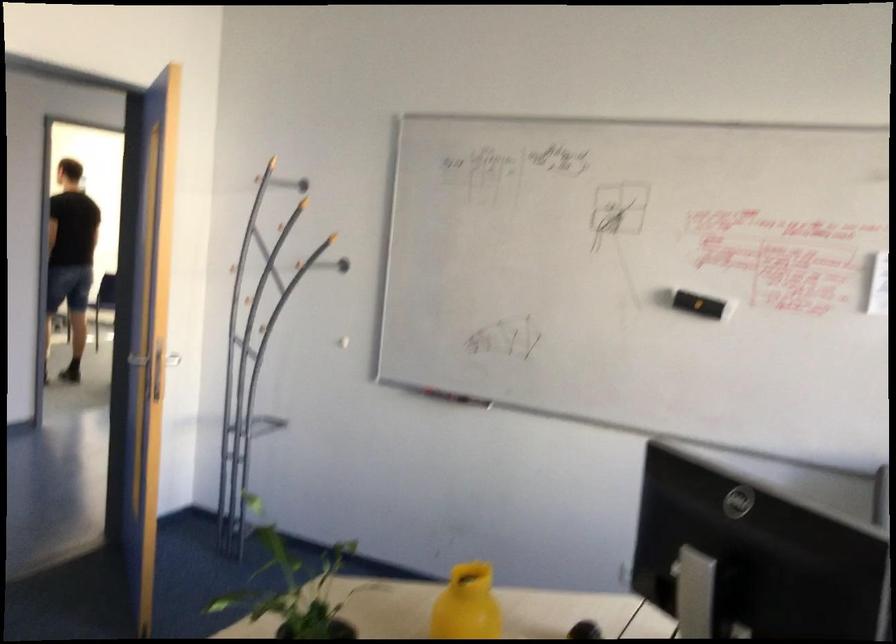
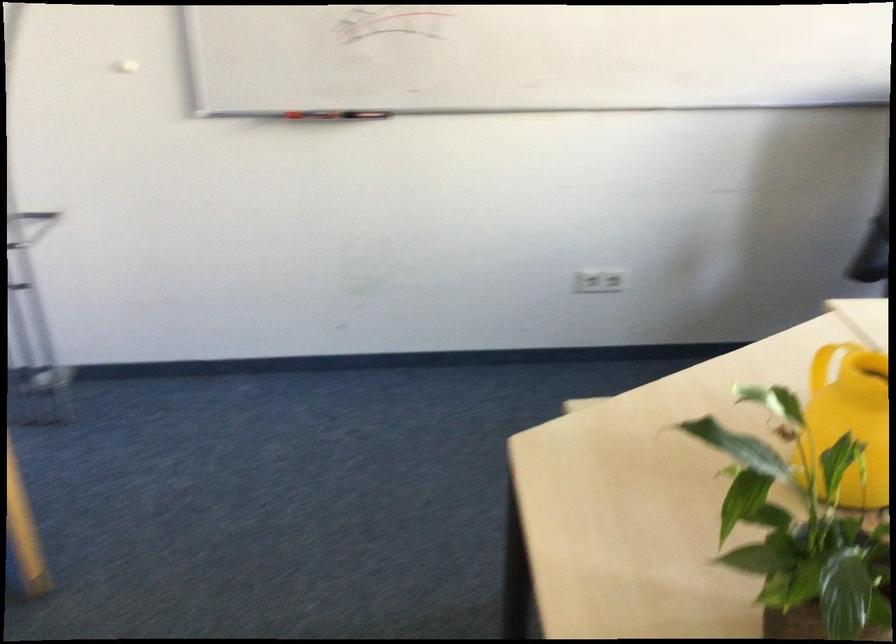
The point at [450,386] is marked in the first image. Where is the corresponding point in the second image?

(330, 114)